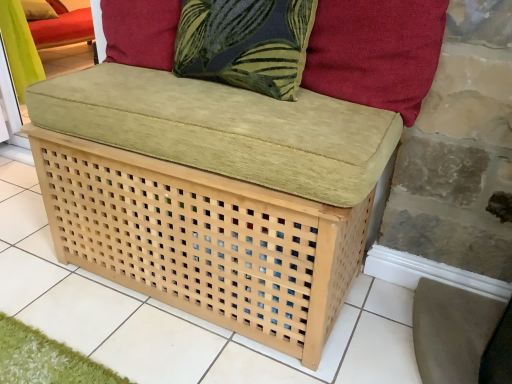
Question: Considering the relative positions of dark blue fabric pillow at upper center and suede-like red cushion at upper right, the 1th pillow viewed from the right, in the image provided, is dark blue fabric pillow at upper center behind suede-like red cushion at upper right, the 1th pillow viewed from the right,?

Choices:
 (A) yes
 (B) no

Answer: (A)

Question: Considering the relative sizes of dark blue fabric pillow at upper center and suede-like red cushion at upper right, the 1th pillow viewed from the right, in the image provided, is dark blue fabric pillow at upper center smaller than suede-like red cushion at upper right, the 1th pillow viewed from the right,?

Choices:
 (A) yes
 (B) no

Answer: (B)

Question: Would you consider dark blue fabric pillow at upper center to be distant from suede-like red cushion at upper right, which appears as the first pillow when ordered from the bottom?

Choices:
 (A) yes
 (B) no

Answer: (B)

Question: Is dark blue fabric pillow at upper center turned away from suede-like red cushion at upper right, marked as the 2th pillow in a top-to-bottom arrangement?

Choices:
 (A) no
 (B) yes

Answer: (A)

Question: Considering the relative sizes of dark blue fabric pillow at upper center and suede-like red cushion at upper right, positioned as the first pillow in front-to-back order, in the image provided, is dark blue fabric pillow at upper center thinner than suede-like red cushion at upper right, positioned as the first pillow in front-to-back order,?

Choices:
 (A) no
 (B) yes

Answer: (A)

Question: In terms of size, does velvet cushion at upper left, the 2th pillow positioned from the front, appear bigger or smaller than suede-like red cushion at upper right, the 1th pillow viewed from the right?

Choices:
 (A) big
 (B) small

Answer: (B)

Question: Considering the relative positions of velvet cushion at upper left, the first pillow in the back-to-front sequence, and suede-like red cushion at upper right, marked as the 2th pillow in a top-to-bottom arrangement, in the image provided, is velvet cushion at upper left, the first pillow in the back-to-front sequence, to the left or to the right of suede-like red cushion at upper right, marked as the 2th pillow in a top-to-bottom arrangement,?

Choices:
 (A) right
 (B) left

Answer: (B)

Question: Considering their positions, is velvet cushion at upper left, which ranks as the 1th pillow in left-to-right order, located in front of or behind suede-like red cushion at upper right, positioned as the first pillow in front-to-back order?

Choices:
 (A) behind
 (B) front

Answer: (A)

Question: Looking at their shapes, would you say velvet cushion at upper left, the first pillow in the back-to-front sequence, is wider or thinner than suede-like red cushion at upper right, which appears as the second pillow when viewed from the back?

Choices:
 (A) thin
 (B) wide

Answer: (B)

Question: Does point (265, 62) appear closer or farther from the camera than point (48, 3)?

Choices:
 (A) farther
 (B) closer

Answer: (B)

Question: Considering the positions of dark blue fabric pillow at upper center and velvet cushion at upper left, the first pillow in the back-to-front sequence, in the image, is dark blue fabric pillow at upper center taller or shorter than velvet cushion at upper left, the first pillow in the back-to-front sequence,?

Choices:
 (A) tall
 (B) short

Answer: (A)

Question: Is dark blue fabric pillow at upper center bigger or smaller than velvet cushion at upper left, the 2th pillow positioned from the front?

Choices:
 (A) big
 (B) small

Answer: (A)

Question: From the image's perspective, is dark blue fabric pillow at upper center located above or below velvet cushion at upper left, the 2th pillow positioned from the front?

Choices:
 (A) below
 (B) above

Answer: (A)

Question: Is suede-like red cushion at upper right, positioned as the first pillow in front-to-back order, in front of or behind dark blue fabric pillow at upper center in the image?

Choices:
 (A) behind
 (B) front

Answer: (B)

Question: Based on their positions, is suede-like red cushion at upper right, the 1th pillow viewed from the right, located to the left or right of dark blue fabric pillow at upper center?

Choices:
 (A) left
 (B) right

Answer: (B)